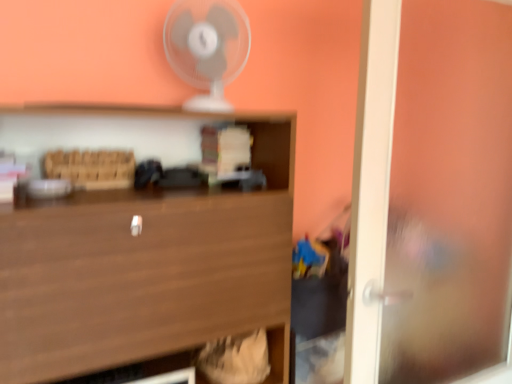
Question: Considering the relative sizes of white plastic fan at upper center and transparent glass door at right in the image provided, is white plastic fan at upper center bigger than transparent glass door at right?

Choices:
 (A) no
 (B) yes

Answer: (A)

Question: From a real-world perspective, is white plastic fan at upper center on transparent glass door at right?

Choices:
 (A) yes
 (B) no

Answer: (A)

Question: Does white plastic fan at upper center appear on the left side of transparent glass door at right?

Choices:
 (A) no
 (B) yes

Answer: (B)

Question: From a real-world perspective, is white plastic fan at upper center located beneath transparent glass door at right?

Choices:
 (A) yes
 (B) no

Answer: (B)

Question: Considering the relative sizes of white plastic fan at upper center and transparent glass door at right in the image provided, is white plastic fan at upper center smaller than transparent glass door at right?

Choices:
 (A) yes
 (B) no

Answer: (A)

Question: From the image's perspective, is wooden at center located above or below white plastic fan at upper center?

Choices:
 (A) below
 (B) above

Answer: (A)

Question: Considering the positions of wooden at center and white plastic fan at upper center in the image, is wooden at center bigger or smaller than white plastic fan at upper center?

Choices:
 (A) small
 (B) big

Answer: (B)

Question: Is point (274, 331) positioned closer to the camera than point (211, 0)?

Choices:
 (A) farther
 (B) closer

Answer: (B)

Question: From a real-world perspective, relative to white plastic fan at upper center, is wooden at center vertically above or below?

Choices:
 (A) below
 (B) above

Answer: (A)

Question: Which is correct: transparent glass door at right is inside wooden at center, or outside of it?

Choices:
 (A) inside
 (B) outside

Answer: (B)

Question: From the image's perspective, is transparent glass door at right above or below wooden at center?

Choices:
 (A) above
 (B) below

Answer: (A)

Question: Visually, is transparent glass door at right positioned to the left or to the right of wooden at center?

Choices:
 (A) right
 (B) left

Answer: (A)

Question: Looking at their shapes, would you say transparent glass door at right is wider or thinner than wooden at center?

Choices:
 (A) thin
 (B) wide

Answer: (A)

Question: From the image's perspective, is wooden at center above or below transparent glass door at right?

Choices:
 (A) above
 (B) below

Answer: (B)

Question: From a real-world perspective, is wooden at center physically located above or below transparent glass door at right?

Choices:
 (A) above
 (B) below

Answer: (B)